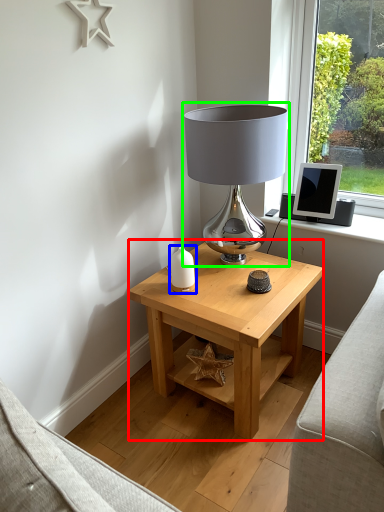
Question: Estimate the real-world distances between objects in this image. Which object is closer to table (highlighted by a red box), candle holder (highlighted by a blue box) or lamp (highlighted by a green box)?

Choices:
 (A) candle holder
 (B) lamp

Answer: (A)